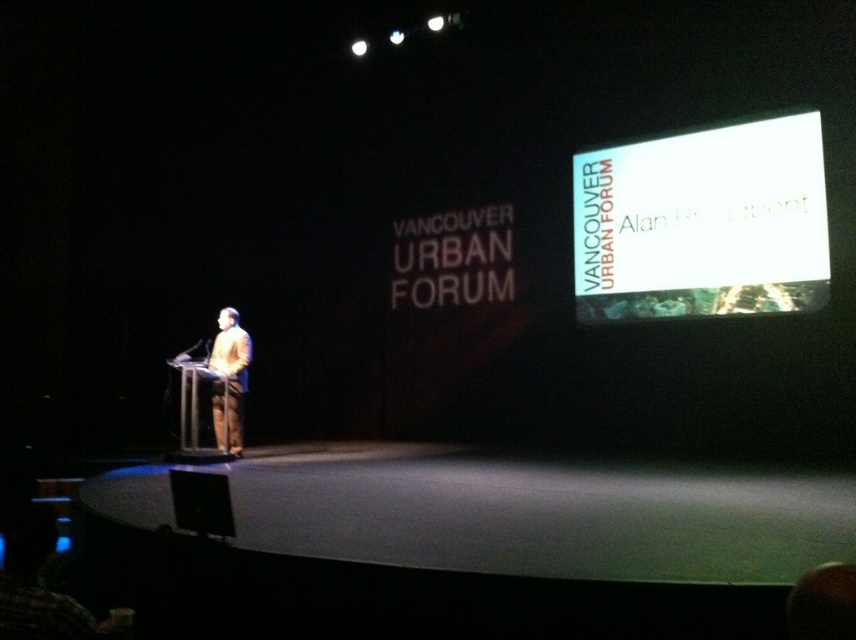
Question: Among these points, which one is farthest from the camera?

Choices:
 (A) (230, 404)
 (B) (708, 266)

Answer: (B)

Question: Which point appears closest to the camera in this image?

Choices:
 (A) (730, 230)
 (B) (229, 408)

Answer: (B)

Question: Which point is farther from the camera taking this photo?

Choices:
 (A) (232, 433)
 (B) (771, 186)

Answer: (A)

Question: Does white glossy projection screen at upper right appear under matte brown suit at center?

Choices:
 (A) yes
 (B) no

Answer: (B)

Question: Can you confirm if white glossy projection screen at upper right is positioned to the right of matte brown suit at center?

Choices:
 (A) yes
 (B) no

Answer: (A)

Question: Does white glossy projection screen at upper right have a greater width compared to matte brown suit at center?

Choices:
 (A) no
 (B) yes

Answer: (B)